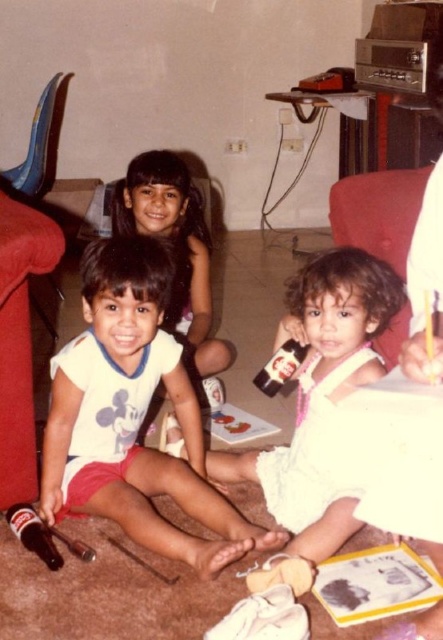
You are organizing a picnic and have two soda containers to choose from. The translucent glass soda at lower left and the matte plastic soda at center. Which one has a greater width?

The translucent glass soda at lower left has a greater width than the matte plastic soda at center.

Based on the photo, you are standing in the living room and want to reach both the point at coordinates (287, 445) and the point at coordinates (291, 353). Which point will you reach first if you move towards them?

You will reach point (287, 445) first because it is closer to you than point (291, 353).

You are a parent trying to serve drinks to your kids. You see a translucent glass soda at lower left and a matte plastic soda at center. Which soda is closer to the left side of the image?

The translucent glass soda at lower left is positioned on the left side of the matte plastic soda at center, so it is closer to the left side of the image.